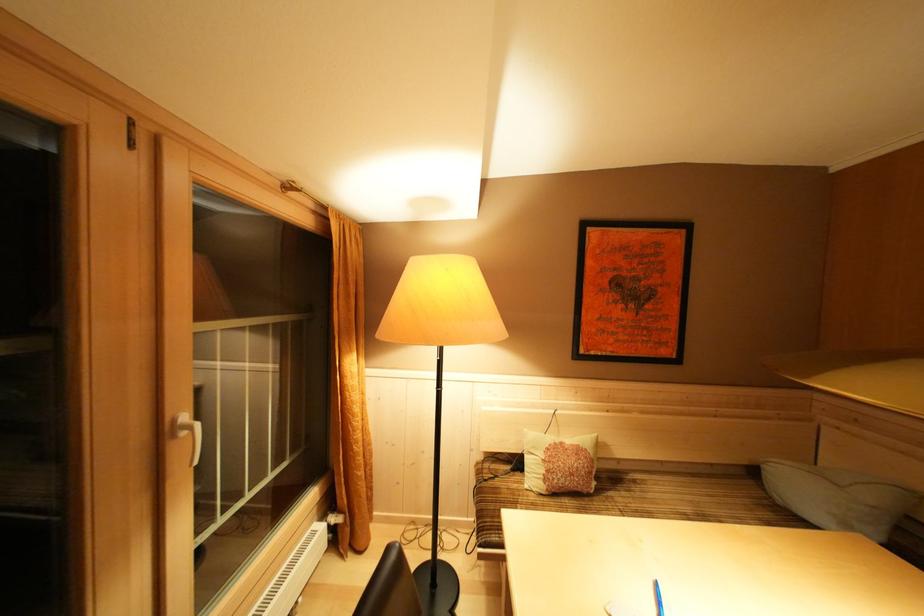
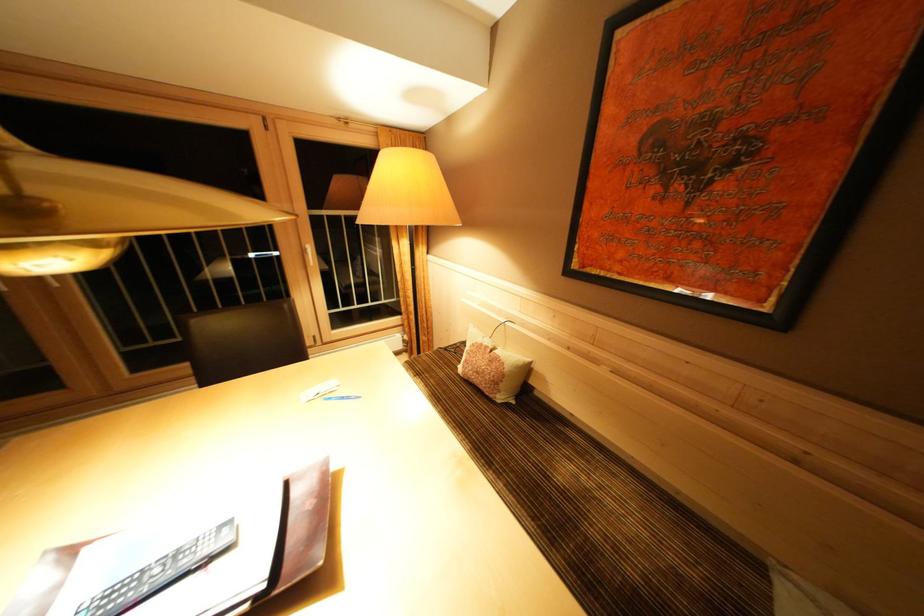
Where in the second image is the point corresponding to (x=641, y=487) from the first image?

(565, 438)